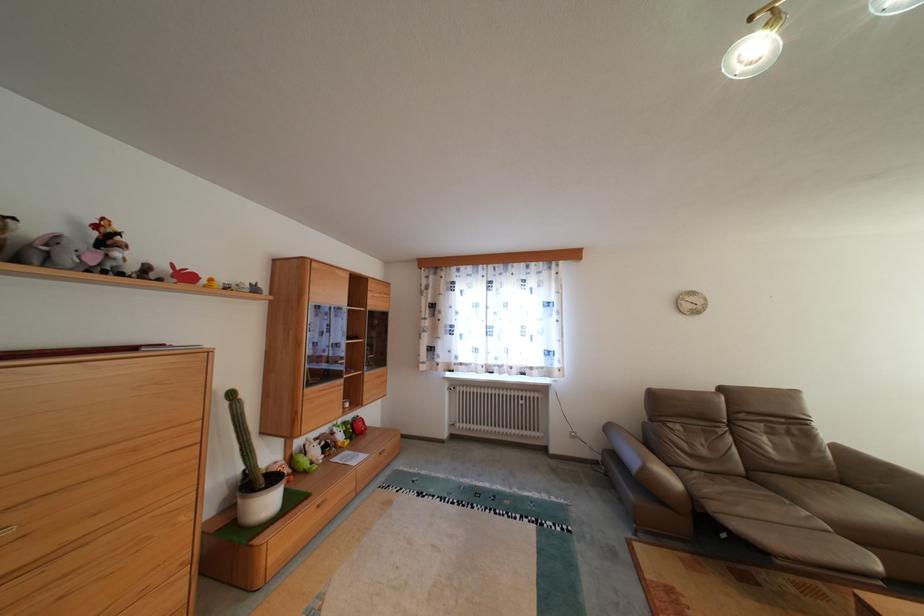
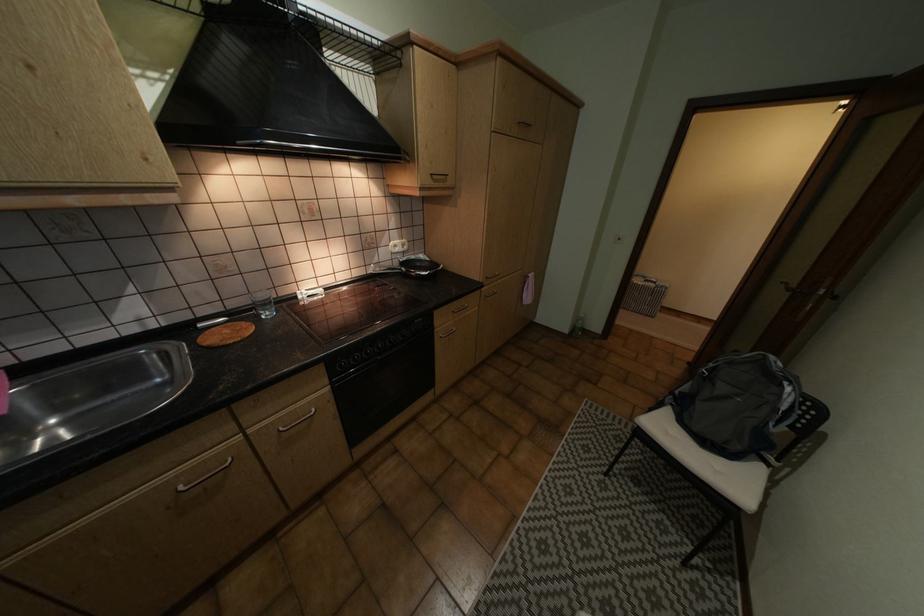
Question: I am providing you with two images of the same scene from different viewpoints. After the viewpoint changes to image2, which objects are now occluded?

Choices:
 (A) beige hiking boot
 (B) ceiling spotlight
 (C) metal cabinet handle
 (D) dark cabinet handle

Answer: (B)